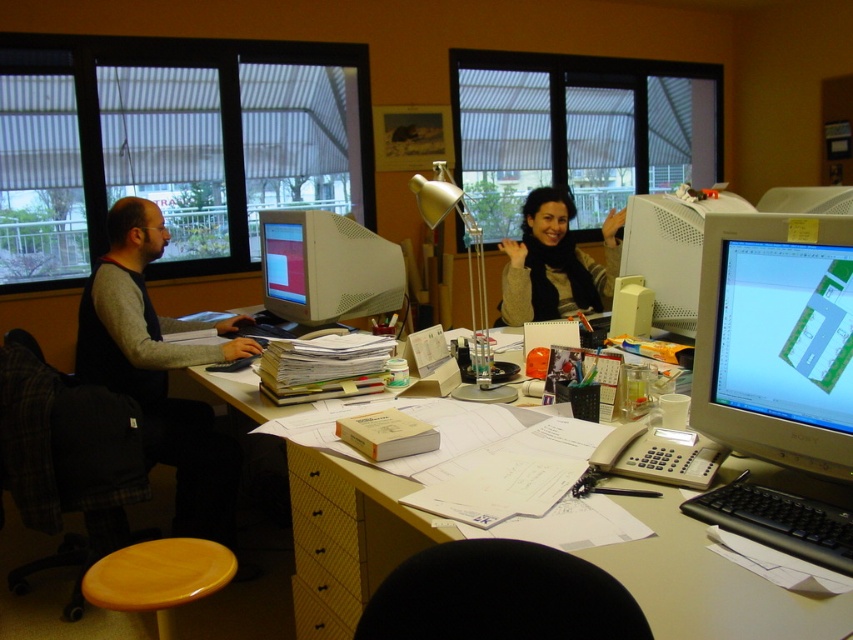
You are standing in the office and want to place a 30 inch wide laptop on the matte yellow desk at center. Can the laptop fit on the desk?

The matte yellow desk at center is 36.30 inches from viewer, so the distance from the viewer to the desk is 36.30 inches. However, the question is about the desk width. Since the desk width isn not provided in the Objects Description, we cannot determine if the laptop will fit. Please provide more information about the desk width.

You are an office worker who wants to adjust the brightness of your matte white monitor at upper right. You notice the gold metallic desk lamp at center is in the way. Can you move the lamp to access the monitor?

The matte white monitor at upper right is behind the gold metallic desk lamp at center, so you can move the gold metallic desk lamp at center to access the matte white monitor at upper right.

From the picture: You are an office worker who needs to locate the gold metallic desk lamp at center in your workspace. According to the coordinates provided, where would you find it?

The gold metallic desk lamp at center is located at coordinates point (468, 280).